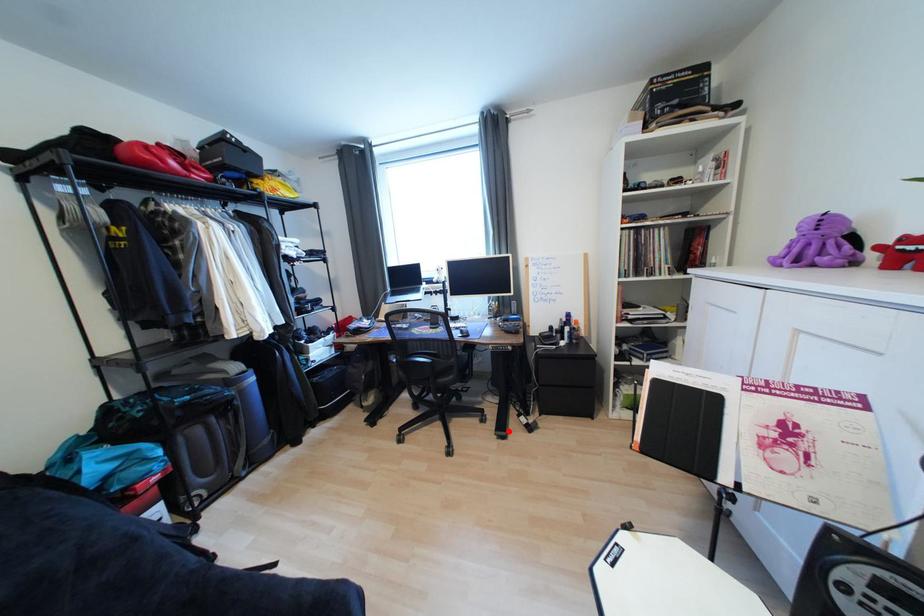
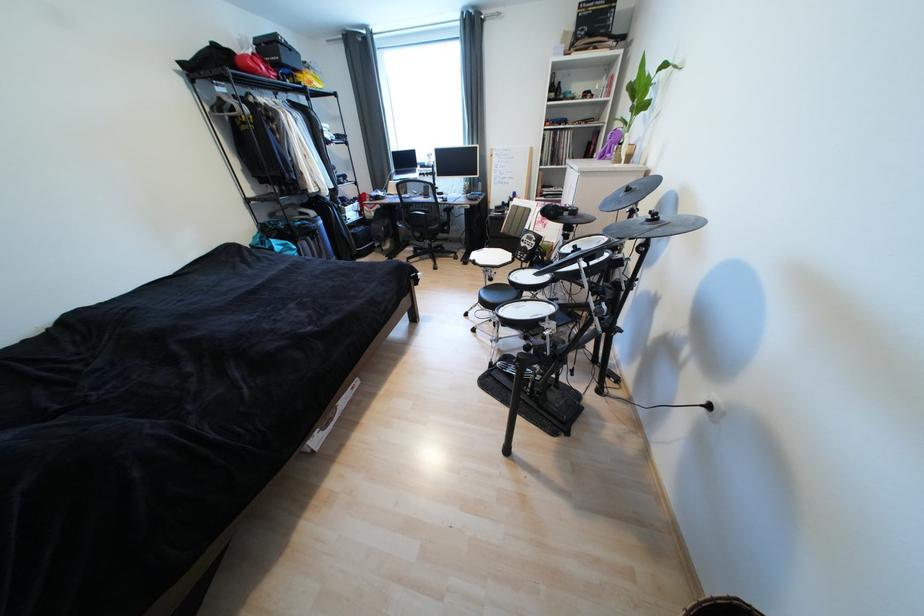
Question: I am providing you with two images of the same scene from different viewpoints. Image1 has a red point marked. In image2, the corresponding 3D location appears at what relative position? Reply with the corresponding letter.

Choices:
 (A) Closer
 (B) Farther

Answer: (B)